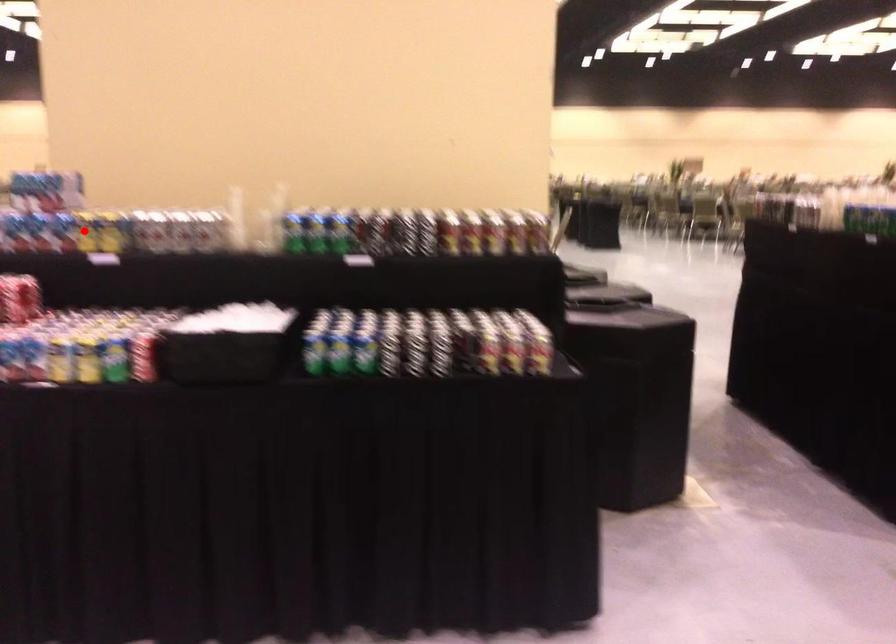
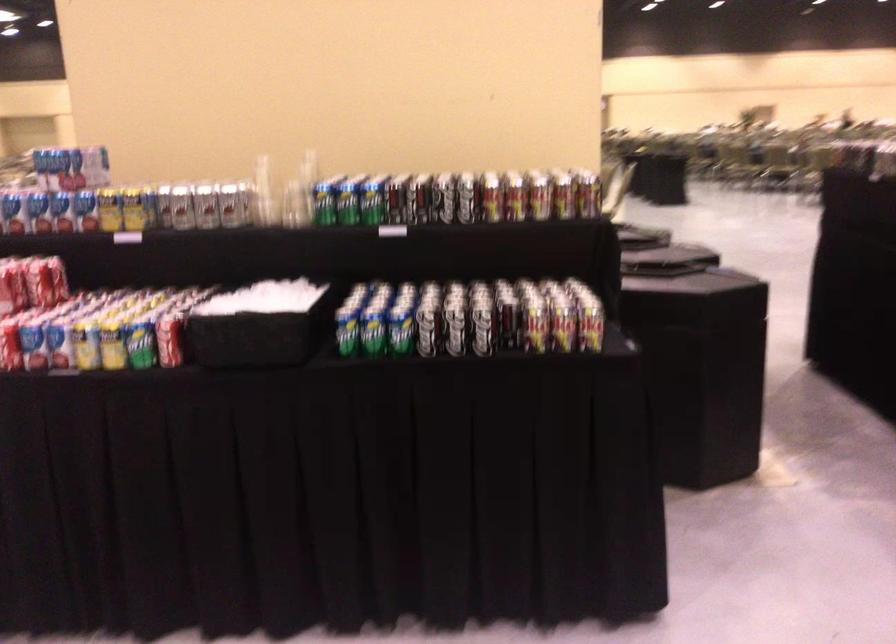
In the second image, find the point that corresponds to the highlighted location in the first image.

(108, 210)